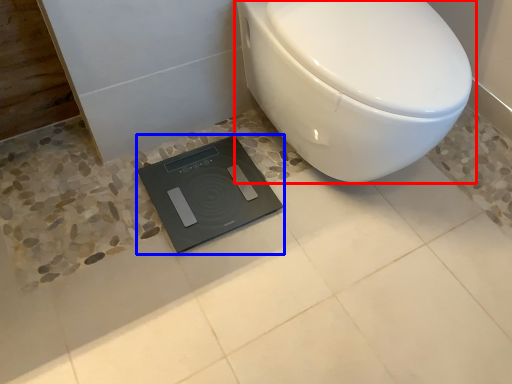
Question: Which object appears closest to the camera in this image, toilet (highlighted by a red box) or scale (highlighted by a blue box)?

Choices:
 (A) toilet
 (B) scale

Answer: (A)